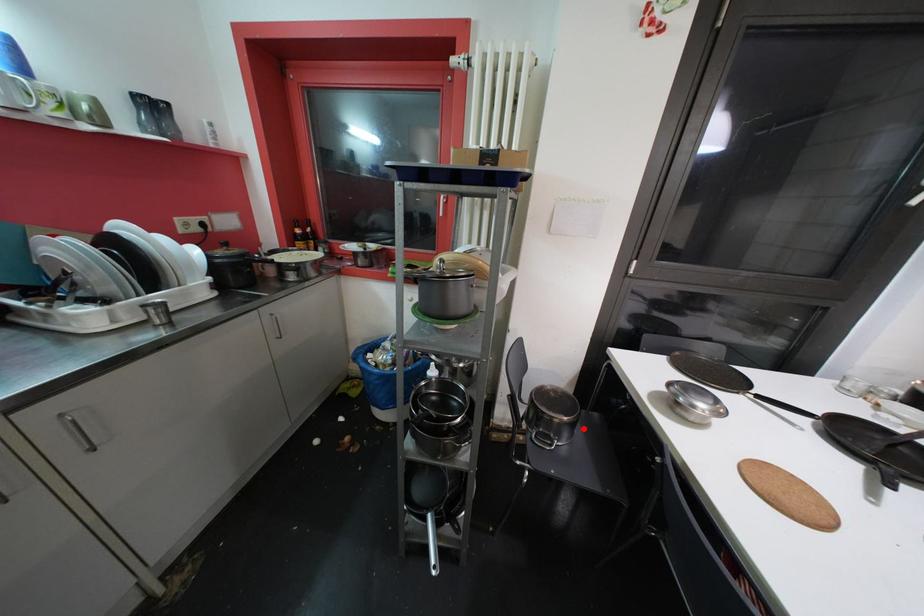
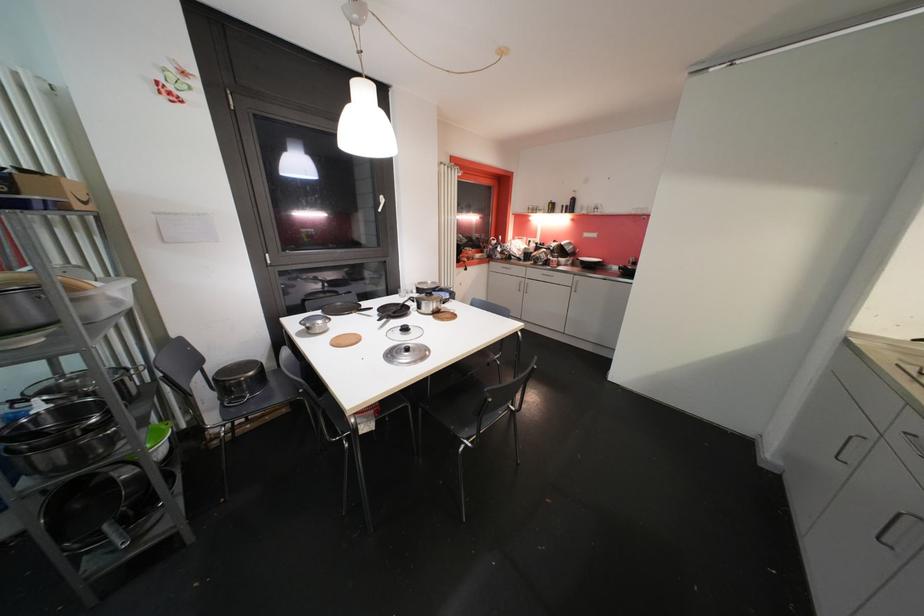
Find the pixel in the second image that matches the highlighted location in the first image.

(274, 379)